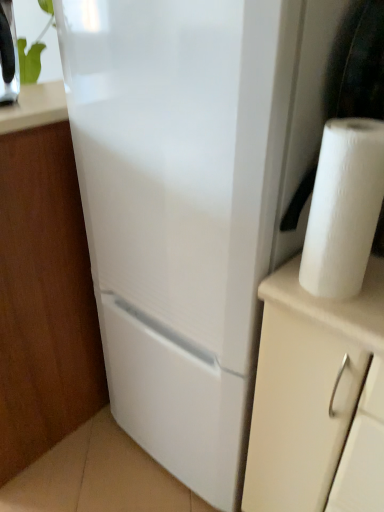
Question: Is green leafy plant at upper left smaller than white matte cabinet at lower left?

Choices:
 (A) yes
 (B) no

Answer: (A)

Question: From a real-world perspective, is green leafy plant at upper left physically below white matte cabinet at lower left?

Choices:
 (A) no
 (B) yes

Answer: (A)

Question: Can you see green leafy plant at upper left touching white matte cabinet at lower left?

Choices:
 (A) yes
 (B) no

Answer: (B)

Question: Is green leafy plant at upper left wider than white matte cabinet at lower left?

Choices:
 (A) no
 (B) yes

Answer: (A)

Question: Could you tell me if green leafy plant at upper left is turned towards white matte cabinet at lower left?

Choices:
 (A) no
 (B) yes

Answer: (A)

Question: From a real-world perspective, is white matte cabinet at lower left above or below white paper at right?

Choices:
 (A) below
 (B) above

Answer: (A)

Question: Looking at the image, does white matte cabinet at lower left seem bigger or smaller compared to white paper at right?

Choices:
 (A) small
 (B) big

Answer: (B)

Question: Considering the relative positions of white matte cabinet at lower left and white paper at right in the image provided, is white matte cabinet at lower left to the left or to the right of white paper at right?

Choices:
 (A) right
 (B) left

Answer: (B)

Question: From the image's perspective, is white matte cabinet at lower left above or below white paper at right?

Choices:
 (A) below
 (B) above

Answer: (A)

Question: Is white paper at right taller or shorter than green leafy plant at upper left?

Choices:
 (A) tall
 (B) short

Answer: (A)

Question: From the image's perspective, is white paper at right above or below green leafy plant at upper left?

Choices:
 (A) above
 (B) below

Answer: (B)

Question: From a real-world perspective, is white paper at right above or below green leafy plant at upper left?

Choices:
 (A) below
 (B) above

Answer: (A)

Question: Looking at their shapes, would you say white paper at right is wider or thinner than green leafy plant at upper left?

Choices:
 (A) thin
 (B) wide

Answer: (A)

Question: Is white matte cabinet at lower left bigger or smaller than green leafy plant at upper left?

Choices:
 (A) small
 (B) big

Answer: (B)

Question: Do you think white matte cabinet at lower left is within green leafy plant at upper left, or outside of it?

Choices:
 (A) outside
 (B) inside

Answer: (A)